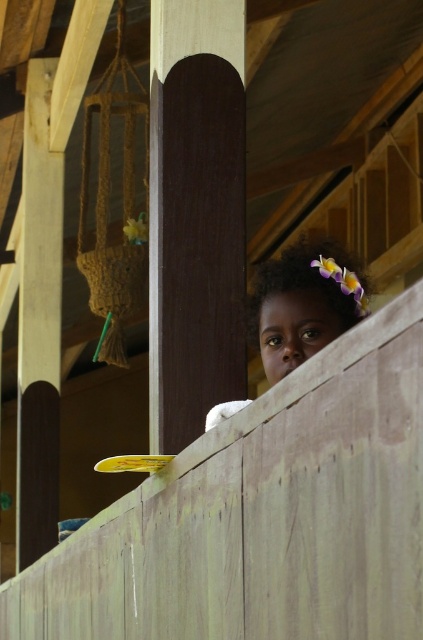
You are an interior designer assessing the space. You need to determine if the dark wood pole at center can fit through a doorway that is the same width as the dark brown hair at upper center. Will it fit?

The dark wood pole at center has a lesser width compared to the dark brown hair at upper center, so it will fit through the doorway.

In the scene shown: You are standing on the wooden porch and notice the dark wood pole at center and the dark brown hair at upper center. Which object is positioned more to the left?

The dark wood pole at center is positioned more to the left than the dark brown hair at upper center.

You are designing a layout for a porch decoration. You have two items to place, the dark wood pole at center and the dark brown hair at upper center. Which item requires more space due to its size?

The dark wood pole at center requires more space because it is larger in size than the dark brown hair at upper center according to the description.